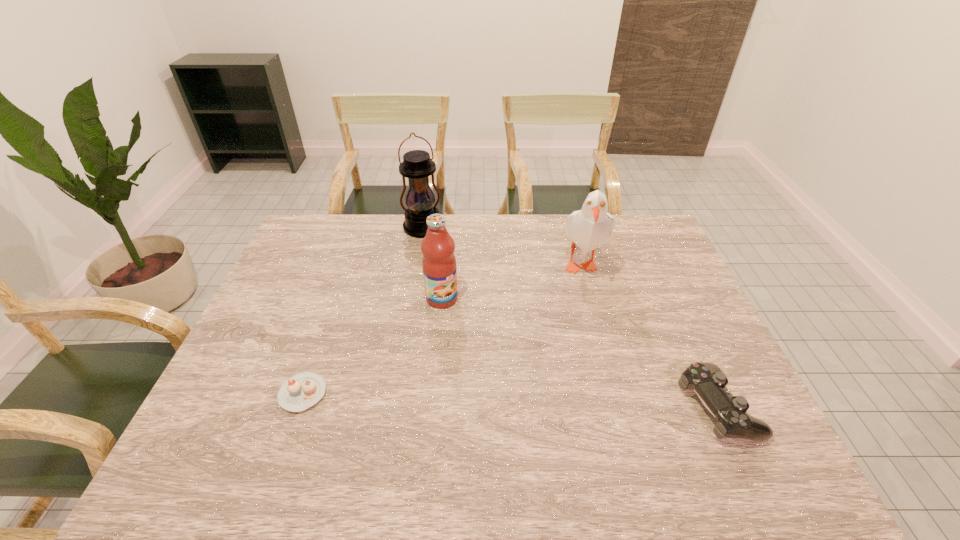
Locate an element on the screen. This screenshot has width=960, height=540. cupcake is located at coordinates pos(303,390).

Find the location of a particular element. the shortest object is located at coordinates (303, 390).

The width and height of the screenshot is (960, 540). Identify the location of control. (708, 381).

Locate an element on the screen. Image resolution: width=960 pixels, height=540 pixels. the rightmost object is located at coordinates (708, 381).

Find the location of a particular element. Image resolution: width=960 pixels, height=540 pixels. fruit juice is located at coordinates (439, 266).

Where is `gull`? gull is located at coordinates (589, 228).

Identify the location of lantern. (417, 166).

Locate an element on the screen. free space located on the right of the shortest object is located at coordinates tap(411, 393).

The image size is (960, 540). Find the location of `free region located 0.240m on the back of the fourth tallest object`. free region located 0.240m on the back of the fourth tallest object is located at coordinates (669, 303).

Image resolution: width=960 pixels, height=540 pixels. In order to click on blank area located on the front label of the fruit juice in this screenshot , I will do `click(509, 374)`.